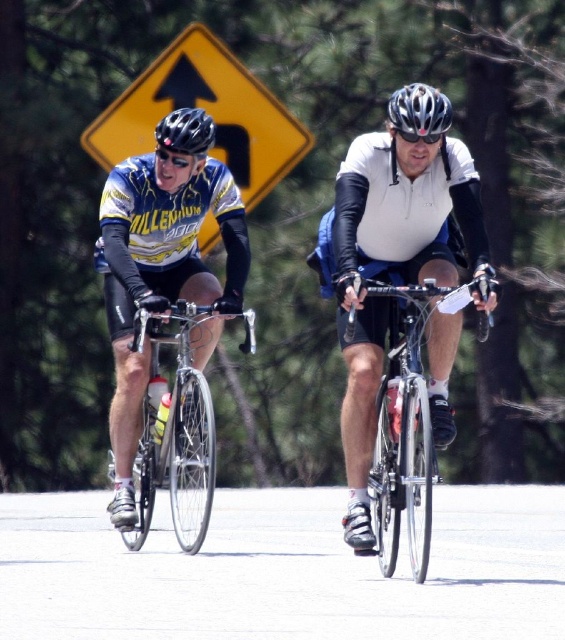
You are a cyclist participating in a race and need to reach the finish line as quickly as possible. You see two checkpoints marked by points on the road ahead. Which checkpoint, point 1 at coordinates (189,388) or point 2 at coordinates (402,100), should you prioritize reaching first?

Point 2 at coordinates (402,100) should be prioritized first because according to the description, point 1 is behind point 2. Therefore, you should reach point 2 first before proceeding to point 1.

You are standing at the point marked as point (145, 70). You want to walk to the road where the cyclists are riding. The road is 24.73 meters away from you. If you walk straight towards the road, will you reach it before the cyclists pass by? Assume the cyclists are moving at an average speed of 15 km per hour and you walk at 5 km per hour.

The distance between you and the road is 24.73 meters. To determine if you can reach the road before the cyclists pass, calculate the time it takes for both parties. Your walking speed is 5 km per hour, which converts to approximately 1.39 meters per second. The cyclists travel at 15 km per hour, which is about 4.17 meters per second. The time for you to reach the road is 24.73 meters divided by 1.39 mps, totaling roughly 17.8 seconds. The cyclists would cover the same distance in 24.73 divided by 4.17 mps,

You are a photographer trying to capture both the shiny silver bicycle at center and the matte black helmet at upper left in a single shot. Given that your camera can only focus on objects within a 1.5 meter width, will both objects fit in the frame if they are positioned side by side?

The shiny silver bicycle at center is larger in size than the matte black helmet at upper left. Since the camera can only focus on objects within a 1.5 meter width, it depends on the combined width of both objects. However, without knowing the exact dimensions of each, we cannot definitively say if they will fit. The question should be rephrased to include specific measurements for an accurate answer.